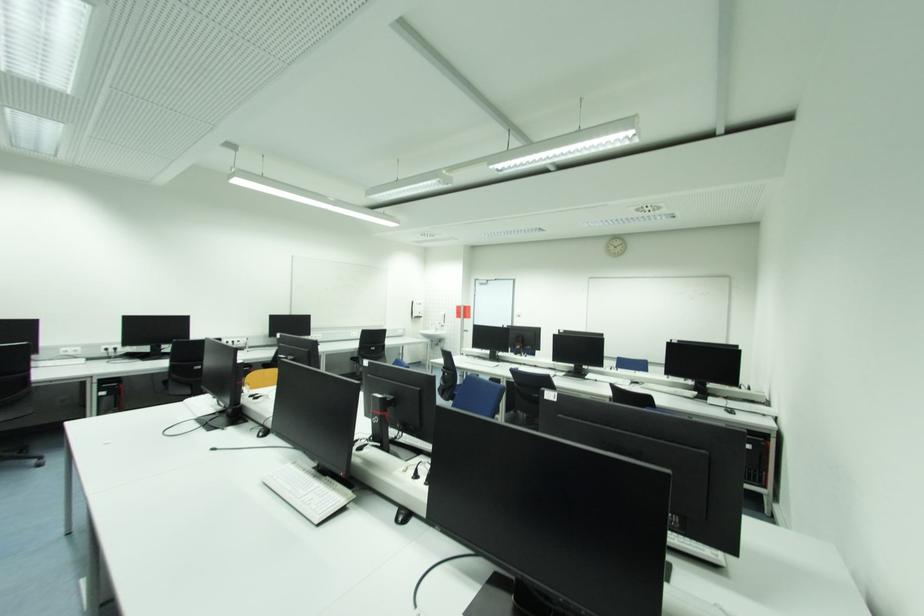
The width and height of the screenshot is (924, 616). What do you see at coordinates (454, 307) in the screenshot?
I see `the red alarm lever` at bounding box center [454, 307].